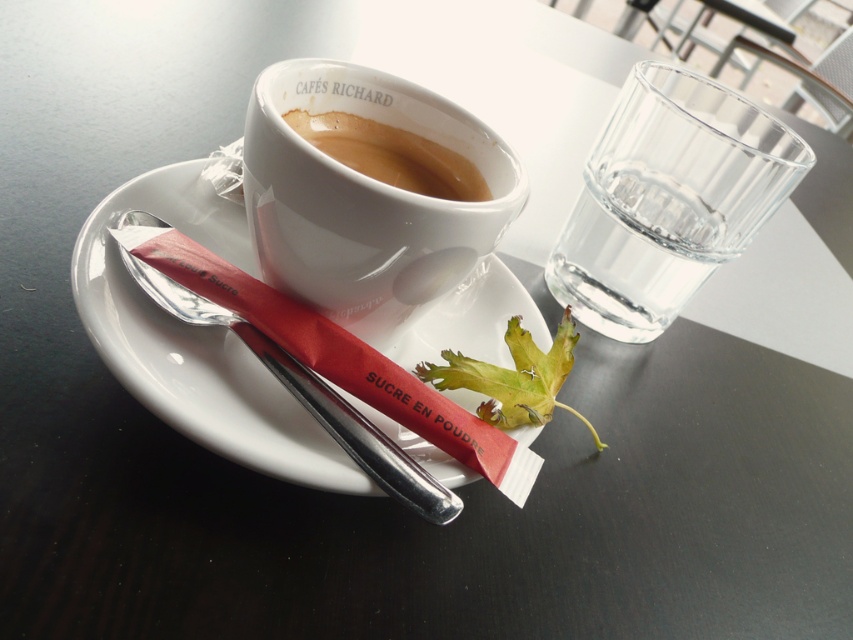
Who is higher up, white ceramic saucer at center or transparent glass at upper right?

transparent glass at upper right

Does point (202, 355) come closer to viewer compared to point (614, 176)?

That is True.

Find the location of a particular element. Image resolution: width=853 pixels, height=640 pixels. white ceramic saucer at center is located at coordinates (196, 339).

Does transparent glass at upper right have a larger size compared to brown glossy cup at upper center?

Indeed, transparent glass at upper right has a larger size compared to brown glossy cup at upper center.

Does point (625, 300) lie behind point (432, 168)?

That is True.

Between point (787, 170) and point (450, 170), which one is positioned behind?

The point (787, 170) is more distant.

This screenshot has width=853, height=640. I want to click on transparent glass at upper right, so click(x=668, y=198).

Is white ceramic saucer at center closer to camera compared to white ceramic mug at upper center?

That is True.

Between point (248, 365) and point (299, 278), which one is positioned behind?

Positioned behind is point (248, 365).

Where is `white ceramic saucer at center`? The height and width of the screenshot is (640, 853). white ceramic saucer at center is located at coordinates (196, 339).